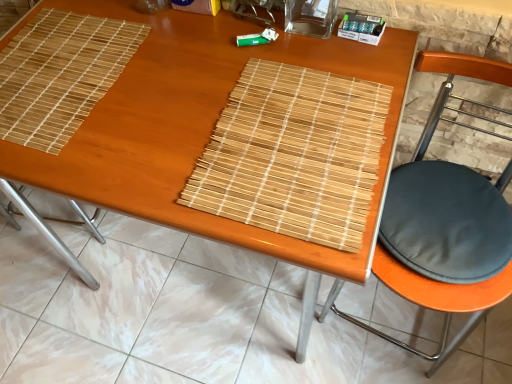
Question: Considering the positions of point (24, 117) and point (501, 297), is point (24, 117) closer or farther from the camera than point (501, 297)?

Choices:
 (A) farther
 (B) closer

Answer: (B)

Question: Is natural wood mat at upper left, which is counted as the 1th mat, starting from the left, bigger or smaller than black fabric cushion at right?

Choices:
 (A) small
 (B) big

Answer: (A)

Question: Which object is positioned closest to the bamboo placemat at center?

Choices:
 (A) natural wood mat at upper left, which is counted as the 1th mat, starting from the left
 (B) black fabric cushion at right
 (C) natural bamboo mat at center, positioned as the second mat in left-to-right order

Answer: (B)

Question: Based on their relative distances, which object is nearer to the natural bamboo mat at center, positioned as the second mat in left-to-right order?

Choices:
 (A) black fabric cushion at right
 (B) bamboo placemat at center
 (C) natural wood mat at upper left, positioned as the second mat in right-to-left order

Answer: (A)